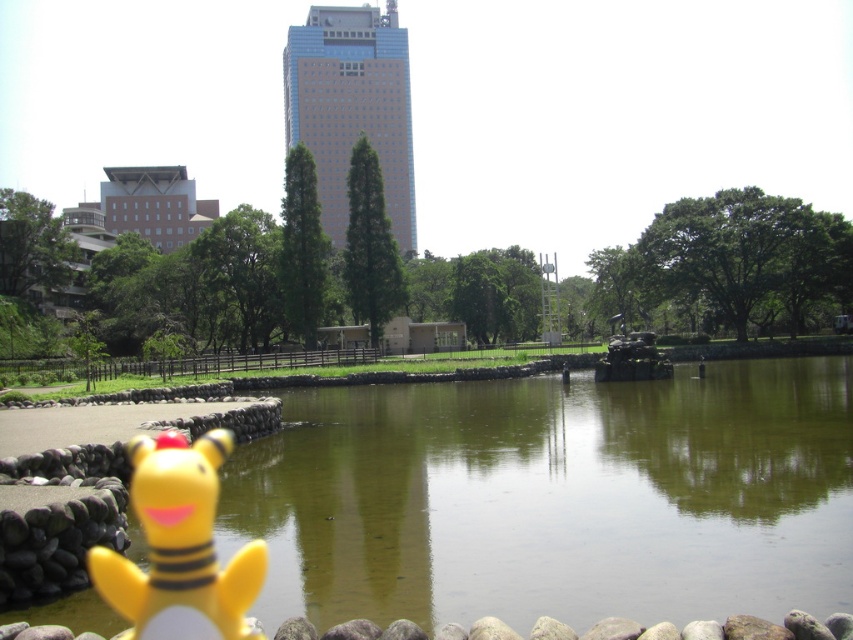
You are standing in the park and want to take a photo of the Pikachu toy figure and the green smooth water at center. Where should you position yourself to capture both subjects in the frame?

To capture both the Pikachu toy figure and the green smooth water at center in the frame, position yourself so that the Pikachu is near the edge of the water and the green smooth water at center is at point (555, 499) in the image plane.

You are standing in the park and see the green smooth water at center and the yellow matte plush toy at lower left. Which object is positioned higher from the ground?

The yellow matte plush toy at lower left is positioned higher than the green smooth water at center because the green smooth water at center is located below it.